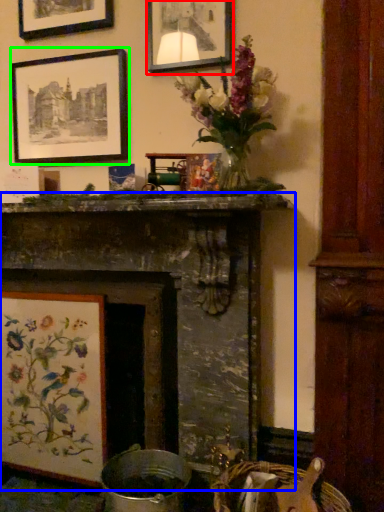
Question: Which is farther away from picture frame (highlighted by a red box)? fireplace (highlighted by a blue box) or picture frame (highlighted by a green box)?

Choices:
 (A) fireplace
 (B) picture frame

Answer: (A)